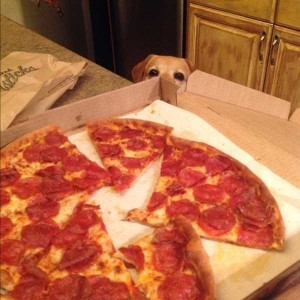
Find the location of a particular element. Image resolution: width=300 pixels, height=300 pixels. grease stain is located at coordinates (229, 265).